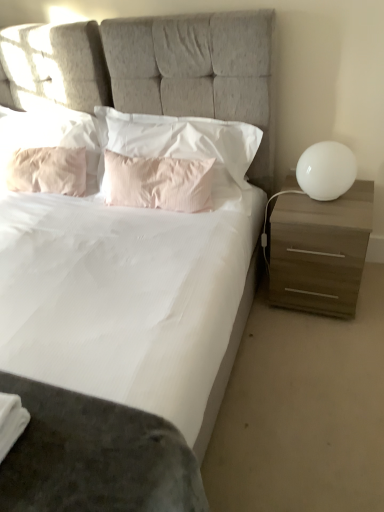
Identify the location of pink satin pillow at center, marked as the 2th pillow in a right-to-left arrangement. (158, 183).

The height and width of the screenshot is (512, 384). Describe the element at coordinates (326, 170) in the screenshot. I see `white glossy sphere at right` at that location.

The height and width of the screenshot is (512, 384). What do you see at coordinates (51, 137) in the screenshot?
I see `pink fabric pillow at upper left, placed as the second pillow when sorted from left to right` at bounding box center [51, 137].

The width and height of the screenshot is (384, 512). In order to click on light brown wood nightstand at right in this screenshot , I will do `click(320, 251)`.

Locate an element on the screen. The height and width of the screenshot is (512, 384). pink satin pillow at center, the 3th pillow in the left-to-right sequence is located at coordinates (158, 183).

Is white fabric bed at center next to pink fabric pillow at upper left, the 1th pillow in the left-to-right sequence?

No, white fabric bed at center is not making contact with pink fabric pillow at upper left, the 1th pillow in the left-to-right sequence.

Considering the positions of objects white fabric bed at center and pink fabric pillow at upper left, arranged as the 4th pillow when viewed from the right, in the image provided, who is in front, white fabric bed at center or pink fabric pillow at upper left, arranged as the 4th pillow when viewed from the right,?

white fabric bed at center is in front.

In the scene shown: From the image's perspective, which is above, white fabric bed at center or pink fabric pillow at upper left, the 1th pillow in the left-to-right sequence?

From the image's view, pink fabric pillow at upper left, the 1th pillow in the left-to-right sequence, is above.

Between white fabric bed at center and pink fabric pillow at upper left, the 1th pillow in the left-to-right sequence, which one has smaller size?

With smaller size is pink fabric pillow at upper left, the 1th pillow in the left-to-right sequence.

From the image's perspective, would you say pink satin pillow at center, the 3th pillow in the left-to-right sequence, is positioned over white glossy sphere at right?

No, from the image's perspective, pink satin pillow at center, the 3th pillow in the left-to-right sequence, is not on top of white glossy sphere at right.

Based on the photo, which point is more forward, (117, 174) or (342, 174)?

The point (342, 174) is in front.

Is pink satin pillow at center, marked as the 2th pillow in a right-to-left arrangement, shorter than white glossy sphere at right?

Incorrect, the height of pink satin pillow at center, marked as the 2th pillow in a right-to-left arrangement, does not fall short of that of white glossy sphere at right.

Could you tell me if pink fabric pillow at upper left, arranged as the third pillow when viewed from the right, is turned towards white glossy sphere at right?

No, pink fabric pillow at upper left, arranged as the third pillow when viewed from the right, does not turn towards white glossy sphere at right.

Locate an element on the screen. The height and width of the screenshot is (512, 384). table lamp on the right side of pink fabric pillow at upper left, placed as the second pillow when sorted from left to right is located at coordinates (326, 170).

Is pink fabric pillow at upper left, arranged as the third pillow when viewed from the right, positioned beyond the bounds of white glossy sphere at right?

Yes, pink fabric pillow at upper left, arranged as the third pillow when viewed from the right, is located beyond the bounds of white glossy sphere at right.

Is point (17, 115) positioned after point (352, 170)?

Yes, point (17, 115) is farther from viewer.

Can you confirm if pink cotton pillow at center, which appears as the fourth pillow when viewed from the left, is smaller than pink fabric pillow at upper left, arranged as the 4th pillow when viewed from the right?

Incorrect, pink cotton pillow at center, which appears as the fourth pillow when viewed from the left, is not smaller in size than pink fabric pillow at upper left, arranged as the 4th pillow when viewed from the right.

Between pink cotton pillow at center, arranged as the 1th pillow when viewed from the right, and pink fabric pillow at upper left, arranged as the 4th pillow when viewed from the right, which one has larger width?

pink cotton pillow at center, arranged as the 1th pillow when viewed from the right, is wider.

Is pink fabric pillow at upper left, the 1th pillow in the left-to-right sequence, a part of pink cotton pillow at center, which appears as the fourth pillow when viewed from the left?

No, pink fabric pillow at upper left, the 1th pillow in the left-to-right sequence, is located outside of pink cotton pillow at center, which appears as the fourth pillow when viewed from the left.

Which of these two, pink cotton pillow at center, arranged as the 1th pillow when viewed from the right, or pink fabric pillow at upper left, the 1th pillow in the left-to-right sequence, stands shorter?

pink fabric pillow at upper left, the 1th pillow in the left-to-right sequence.

Is white fabric bed at center wider or thinner than white glossy sphere at right?

In the image, white fabric bed at center appears to be wider than white glossy sphere at right.

Is white fabric bed at center situated inside white glossy sphere at right or outside?

white fabric bed at center is spatially situated outside white glossy sphere at right.

From the image's perspective, who appears lower, white fabric bed at center or white glossy sphere at right?

white fabric bed at center.

Considering the points (9, 475) and (297, 177), which point is behind, point (9, 475) or point (297, 177)?

The point (297, 177) is farther from the camera.

Between pink satin pillow at center, the 3th pillow in the left-to-right sequence, and pink fabric pillow at upper left, arranged as the third pillow when viewed from the right, which one is positioned in front?

pink satin pillow at center, the 3th pillow in the left-to-right sequence, is more forward.

From a real-world perspective, is pink satin pillow at center, marked as the 2th pillow in a right-to-left arrangement, on pink fabric pillow at upper left, arranged as the third pillow when viewed from the right?

Actually, pink satin pillow at center, marked as the 2th pillow in a right-to-left arrangement, is physically below pink fabric pillow at upper left, arranged as the third pillow when viewed from the right, in the real world.

Is pink satin pillow at center, marked as the 2th pillow in a right-to-left arrangement, far from pink fabric pillow at upper left, placed as the second pillow when sorted from left to right?

No, pink satin pillow at center, marked as the 2th pillow in a right-to-left arrangement, is in close proximity to pink fabric pillow at upper left, placed as the second pillow when sorted from left to right.

Is light brown wood nightstand at right not near pink cotton pillow at center, arranged as the 1th pillow when viewed from the right?

No, light brown wood nightstand at right is in close proximity to pink cotton pillow at center, arranged as the 1th pillow when viewed from the right.

Considering the sizes of light brown wood nightstand at right and pink cotton pillow at center, which appears as the fourth pillow when viewed from the left, in the image, is light brown wood nightstand at right wider or thinner than pink cotton pillow at center, which appears as the fourth pillow when viewed from the left,?

Clearly, light brown wood nightstand at right has more width compared to pink cotton pillow at center, which appears as the fourth pillow when viewed from the left.

Based on the photo, based on their sizes in the image, would you say light brown wood nightstand at right is bigger or smaller than pink cotton pillow at center, arranged as the 1th pillow when viewed from the right?

In the image, light brown wood nightstand at right appears to be larger than pink cotton pillow at center, arranged as the 1th pillow when viewed from the right.

Would you say light brown wood nightstand at right is to the left or to the right of pink cotton pillow at center, which appears as the fourth pillow when viewed from the left, in the picture?

light brown wood nightstand at right is positioned on pink cotton pillow at center, which appears as the fourth pillow when viewed from the left,'s right side.

Which pillow is the 2nd one when counting from the left side of the white fabric bed at center? Please provide its 2D coordinates.

[(47, 170)]

The image size is (384, 512). I want to click on pillow below the white glossy sphere at right (from the image's perspective), so click(158, 183).

Looking at this image, considering their positions, is pink cotton pillow at center, arranged as the 1th pillow when viewed from the right, positioned further to pink satin pillow at center, the 3th pillow in the left-to-right sequence, than white fabric bed at center?

Among the two, white fabric bed at center is located further to pink satin pillow at center, the 3th pillow in the left-to-right sequence.

When comparing their distances from pink cotton pillow at center, arranged as the 1th pillow when viewed from the right, does white fabric bed at center or pink fabric pillow at upper left, arranged as the third pillow when viewed from the right, seem further?

pink fabric pillow at upper left, arranged as the third pillow when viewed from the right, lies further to pink cotton pillow at center, arranged as the 1th pillow when viewed from the right, than the other object.

Estimate the real-world distances between objects in this image. Which object is further from white fabric bed at center, pink satin pillow at center, marked as the 2th pillow in a right-to-left arrangement, or white glossy sphere at right?

white glossy sphere at right is further to white fabric bed at center.

Which object lies further to the anchor point pink satin pillow at center, marked as the 2th pillow in a right-to-left arrangement, pink cotton pillow at center, arranged as the 1th pillow when viewed from the right, or pink fabric pillow at upper left, placed as the second pillow when sorted from left to right?

pink fabric pillow at upper left, placed as the second pillow when sorted from left to right, lies further to pink satin pillow at center, marked as the 2th pillow in a right-to-left arrangement, than the other object.

Looking at the image, which one is located further to pink fabric pillow at upper left, arranged as the third pillow when viewed from the right, white glossy sphere at right or pink satin pillow at center, the 3th pillow in the left-to-right sequence?

white glossy sphere at right lies further to pink fabric pillow at upper left, arranged as the third pillow when viewed from the right, than the other object.

Considering their positions, is light brown wood nightstand at right positioned further to pink fabric pillow at upper left, arranged as the third pillow when viewed from the right, than pink satin pillow at center, marked as the 2th pillow in a right-to-left arrangement?

light brown wood nightstand at right is positioned further to the anchor pink fabric pillow at upper left, arranged as the third pillow when viewed from the right.

Looking at the image, which one is located closer to white fabric bed at center, pink fabric pillow at upper left, placed as the second pillow when sorted from left to right, or white glossy sphere at right?

pink fabric pillow at upper left, placed as the second pillow when sorted from left to right, is closer to white fabric bed at center.

Estimate the real-world distances between objects in this image. Which object is further from light brown wood nightstand at right, pink satin pillow at center, marked as the 2th pillow in a right-to-left arrangement, or white glossy sphere at right?

pink satin pillow at center, marked as the 2th pillow in a right-to-left arrangement, is positioned further to the anchor light brown wood nightstand at right.

I want to click on table lamp between pink fabric pillow at upper left, arranged as the third pillow when viewed from the right, and light brown wood nightstand at right from left to right, so click(x=326, y=170).

At what (x,y) coordinates should I click in order to perform the action: click on table lamp located between white fabric bed at center and pink fabric pillow at upper left, arranged as the third pillow when viewed from the right, in the depth direction. Please return your answer as a coordinate pair (x, y). This screenshot has width=384, height=512. Looking at the image, I should click on pos(326,170).

The height and width of the screenshot is (512, 384). Identify the location of table lamp between pink satin pillow at center, marked as the 2th pillow in a right-to-left arrangement, and light brown wood nightstand at right from left to right. (326, 170).

Image resolution: width=384 pixels, height=512 pixels. Find the location of `pillow between pink fabric pillow at upper left, placed as the second pillow when sorted from left to right, and pink cotton pillow at center, arranged as the 1th pillow when viewed from the right`. pillow between pink fabric pillow at upper left, placed as the second pillow when sorted from left to right, and pink cotton pillow at center, arranged as the 1th pillow when viewed from the right is located at coordinates tap(158, 183).